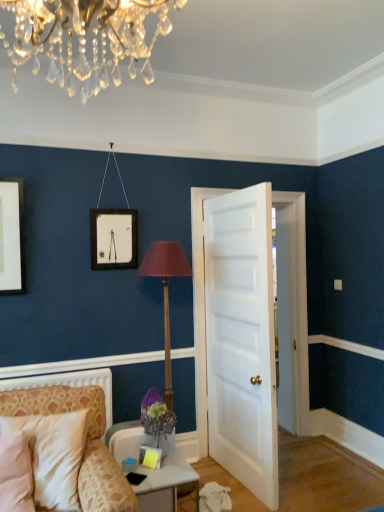
Question: From a real-world perspective, is patterned fabric chair at lower left located higher than white painted wood door at center?

Choices:
 (A) yes
 (B) no

Answer: (B)

Question: From a real-world perspective, is patterned fabric chair at lower left beneath white painted wood door at center?

Choices:
 (A) yes
 (B) no

Answer: (A)

Question: Could white painted wood door at center be considered to be inside patterned fabric chair at lower left?

Choices:
 (A) yes
 (B) no

Answer: (B)

Question: Is patterned fabric chair at lower left at the right side of white painted wood door at center?

Choices:
 (A) no
 (B) yes

Answer: (A)

Question: Is patterned fabric chair at lower left outside of white painted wood door at center?

Choices:
 (A) no
 (B) yes

Answer: (B)

Question: Considering the relative sizes of patterned fabric chair at lower left and white painted wood door at center in the image provided, is patterned fabric chair at lower left shorter than white painted wood door at center?

Choices:
 (A) no
 (B) yes

Answer: (B)

Question: Is white glossy table at lower center facing towards white painted wood door at center?

Choices:
 (A) no
 (B) yes

Answer: (A)

Question: Does white glossy table at lower center come behind white painted wood door at center?

Choices:
 (A) yes
 (B) no

Answer: (B)

Question: Considering the relative sizes of white glossy table at lower center and white painted wood door at center in the image provided, is white glossy table at lower center taller than white painted wood door at center?

Choices:
 (A) no
 (B) yes

Answer: (A)

Question: Is there a large distance between white glossy table at lower center and white painted wood door at center?

Choices:
 (A) no
 (B) yes

Answer: (A)

Question: Can you confirm if white glossy table at lower center is bigger than white painted wood door at center?

Choices:
 (A) no
 (B) yes

Answer: (A)

Question: Is white glossy table at lower center facing away from white painted wood door at center?

Choices:
 (A) yes
 (B) no

Answer: (B)

Question: Can you confirm if wooden table lamp at center is smaller than white glossy table at lower center?

Choices:
 (A) yes
 (B) no

Answer: (B)